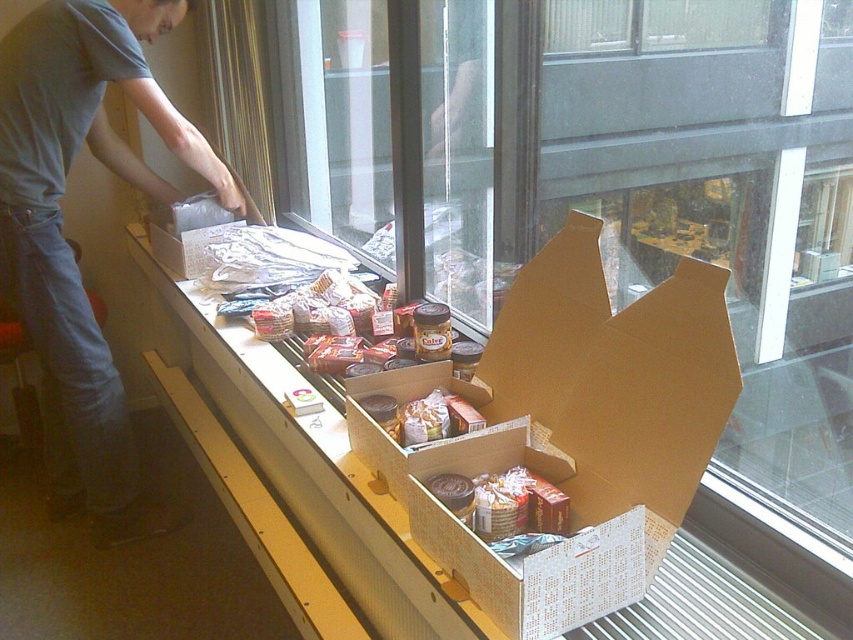
Question: Is gray cotton shirt at upper left wider than shiny metallic can at center?

Choices:
 (A) no
 (B) yes

Answer: (B)

Question: Which point is farther to the camera?

Choices:
 (A) (108, 365)
 (B) (433, 440)

Answer: (A)

Question: Which of the following is the closest to the observer?

Choices:
 (A) (376, 408)
 (B) (509, 525)
 (C) (83, 84)
 (D) (498, 577)

Answer: (D)

Question: Does brown cardboard box at center appear under matte plastic bag of chips at center?

Choices:
 (A) yes
 (B) no

Answer: (B)

Question: In this image, where is gray cotton shirt at upper left located relative to matte plastic bag of chips at center?

Choices:
 (A) left
 (B) right

Answer: (A)

Question: Estimate the real-world distances between objects in this image. Which object is closer to the matte plastic bag of chips at center?

Choices:
 (A) gray cotton shirt at upper left
 (B) shiny metallic can at center
 (C) brown cardboard box at center

Answer: (B)